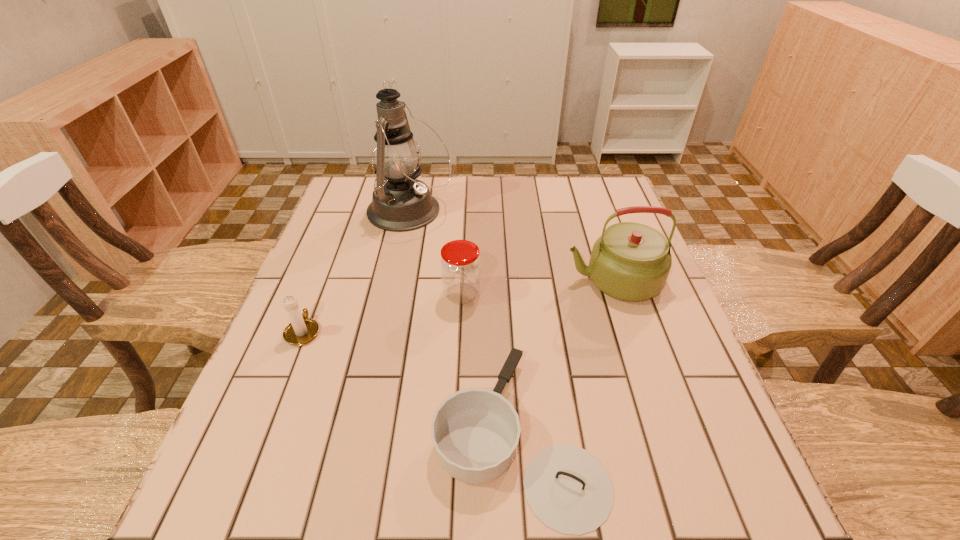
In order to click on the tallest object in this screenshot , I will do `click(400, 202)`.

What are the coordinates of `the farthest object` in the screenshot? It's located at (400, 202).

Image resolution: width=960 pixels, height=540 pixels. What are the coordinates of `the fourth shortest object` in the screenshot? It's located at (631, 261).

This screenshot has width=960, height=540. What are the coordinates of `jar` in the screenshot? It's located at (460, 264).

Where is `the second shortest object`? The image size is (960, 540). the second shortest object is located at coordinates (302, 330).

You are a GUI agent. You are given a task and a screenshot of the screen. Output one action in this format:
    pyautogui.click(x=<x>, y=<y>)
    Task: Click on the fourth farthest object
    The height and width of the screenshot is (540, 960).
    Given the screenshot: What is the action you would take?
    pyautogui.click(x=302, y=330)

Image resolution: width=960 pixels, height=540 pixels. What are the coordinates of `saucepan` in the screenshot? It's located at (475, 431).

You are a GUI agent. You are given a task and a screenshot of the screen. Output one action in this format:
    pyautogui.click(x=<x>, y=<y>)
    Task: Click on the shortest object
    
    Given the screenshot: What is the action you would take?
    pyautogui.click(x=475, y=431)

Find the location of a particular element. free location located on the front of the tallest object is located at coordinates (394, 288).

Find the location of `vacant region located 0.150m at the spout of the kettle`. vacant region located 0.150m at the spout of the kettle is located at coordinates (505, 280).